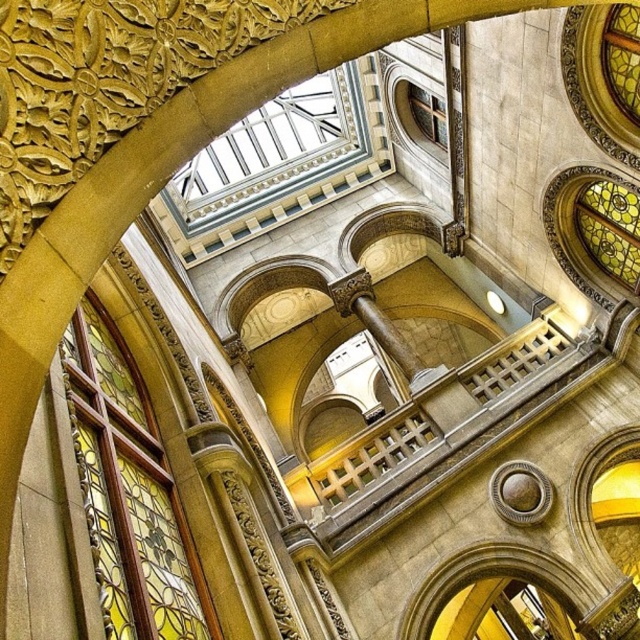
Between stained glass window at left and stained glass window at upper right, which one is positioned lower?

stained glass window at left is below.

Who is positioned more to the right, stained glass window at left or stained glass window at upper right?

Positioned to the right is stained glass window at upper right.

Describe the element at coordinates (131, 490) in the screenshot. This screenshot has width=640, height=640. I see `stained glass window at left` at that location.

Identify the location of stained glass window at left. Image resolution: width=640 pixels, height=640 pixels. (131, 490).

Measure the distance between stained glass window at left and clear glass window at upper center.

A distance of 65.85 meters exists between stained glass window at left and clear glass window at upper center.

From the picture: Between stained glass window at left and clear glass window at upper center, which one appears on the right side from the viewer's perspective?

clear glass window at upper center is more to the right.

Between point (93, 376) and point (426, 93), which one is positioned in front?

Positioned in front is point (93, 376).

What are the coordinates of `stained glass window at left` in the screenshot? It's located at (131, 490).

Is stained glass window at left bigger than transparent glass ceiling at upper center?

No.

Can you confirm if stained glass window at left is wider than transparent glass ceiling at upper center?

No, stained glass window at left is not wider than transparent glass ceiling at upper center.

Image resolution: width=640 pixels, height=640 pixels. I want to click on stained glass window at left, so (131, 490).